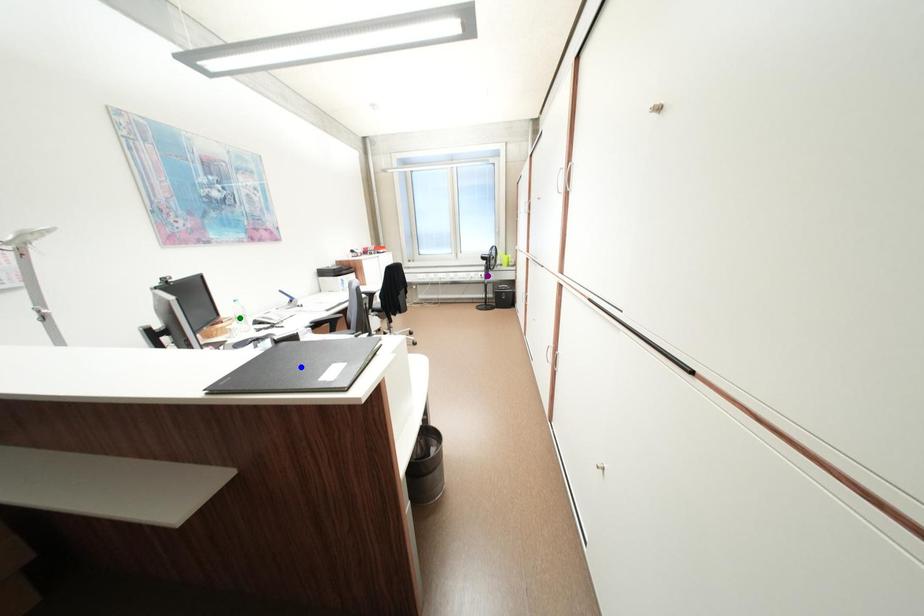
Order these from farthest to nearest:
- purple point
- blue point
- green point

1. purple point
2. green point
3. blue point